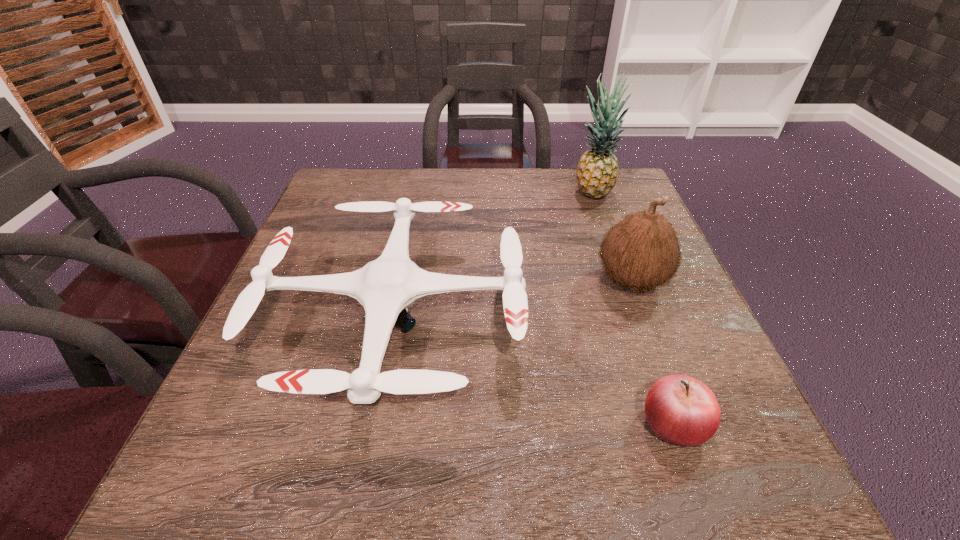
Where is `free space at the far edge of the desktop`? This screenshot has width=960, height=540. free space at the far edge of the desktop is located at coordinates (495, 170).

What are the coordinates of `free location at the near edge of the desktop` in the screenshot? It's located at (x=602, y=454).

Locate an element on the screen. The height and width of the screenshot is (540, 960). vacant space at the left edge of the desktop is located at coordinates 295,358.

Find the location of a particular element. The height and width of the screenshot is (540, 960). vacant space at the right edge of the desktop is located at coordinates (632, 306).

Identify the location of blank space at the far left corner of the desktop. The image size is (960, 540). (359, 190).

I want to click on vacant space at the near left corner of the desktop, so click(x=191, y=486).

Find the location of `free area in between the shortest object and the third tallest object`. free area in between the shortest object and the third tallest object is located at coordinates (535, 371).

Image resolution: width=960 pixels, height=540 pixels. In order to click on free space between the tallest object and the shortest object in this screenshot , I will do `click(633, 309)`.

You are a GUI agent. You are given a task and a screenshot of the screen. Output one action in this format:
    pyautogui.click(x=<x>, y=<y>)
    Task: Click on the vacant space in between the apple and the pineapple
    The width and height of the screenshot is (960, 540).
    Given the screenshot: What is the action you would take?
    pyautogui.click(x=633, y=309)

This screenshot has height=540, width=960. In order to click on vacant space in between the apple and the drone in this screenshot , I will do `click(535, 371)`.